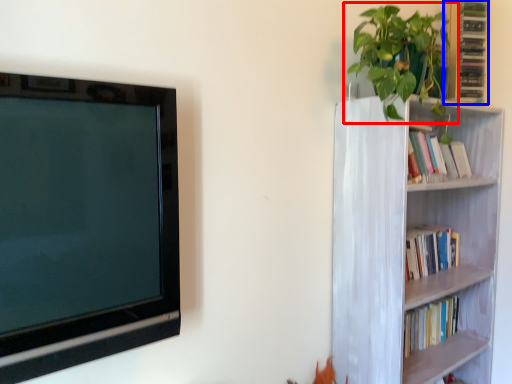
Question: Which of the following is the farthest to the observer, houseplant (highlighted by a red box) or cabinet (highlighted by a blue box)?

Choices:
 (A) houseplant
 (B) cabinet

Answer: (B)